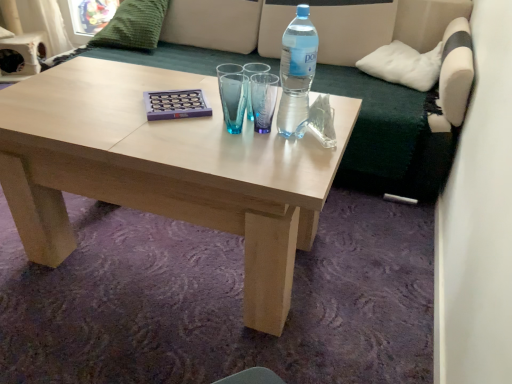
Question: Does green fabric couch at upper center have a lesser width compared to green knitted pillow at upper left, arranged as the first pillow when viewed from the left?

Choices:
 (A) no
 (B) yes

Answer: (A)

Question: From the image's perspective, is green fabric couch at upper center on green knitted pillow at upper left, arranged as the first pillow when viewed from the left?

Choices:
 (A) yes
 (B) no

Answer: (B)

Question: Does green fabric couch at upper center appear on the right side of green knitted pillow at upper left, arranged as the first pillow when viewed from the left?

Choices:
 (A) no
 (B) yes

Answer: (B)

Question: From the image's perspective, is green fabric couch at upper center under green knitted pillow at upper left, the second pillow positioned from the bottom?

Choices:
 (A) yes
 (B) no

Answer: (A)

Question: Is green fabric couch at upper center bigger than green knitted pillow at upper left, which ranks as the first pillow in top-to-bottom order?

Choices:
 (A) no
 (B) yes

Answer: (B)

Question: From the image's perspective, is transparent plastic bottle at upper right above or below natural wood coffee table at center?

Choices:
 (A) above
 (B) below

Answer: (A)

Question: Relative to natural wood coffee table at center, is transparent plastic bottle at upper right in front or behind?

Choices:
 (A) front
 (B) behind

Answer: (B)

Question: Is transparent plastic bottle at upper right inside or outside of natural wood coffee table at center?

Choices:
 (A) outside
 (B) inside

Answer: (A)

Question: From a real-world perspective, is transparent plastic bottle at upper right physically located above or below natural wood coffee table at center?

Choices:
 (A) below
 (B) above

Answer: (B)

Question: Is point (280, 258) closer or farther from the camera than point (283, 34)?

Choices:
 (A) farther
 (B) closer

Answer: (B)

Question: Considering the positions of natural wood coffee table at center and transparent plastic bottle at upper right in the image, is natural wood coffee table at center bigger or smaller than transparent plastic bottle at upper right?

Choices:
 (A) big
 (B) small

Answer: (A)

Question: Would you say natural wood coffee table at center is inside or outside transparent plastic bottle at upper right?

Choices:
 (A) outside
 (B) inside

Answer: (A)

Question: From the image's perspective, is natural wood coffee table at center positioned above or below transparent plastic bottle at upper right?

Choices:
 (A) above
 (B) below

Answer: (B)

Question: Does point (470, 66) appear closer or farther from the camera than point (166, 178)?

Choices:
 (A) farther
 (B) closer

Answer: (A)

Question: From the image's perspective, is green fabric couch at upper center located above or below natural wood coffee table at center?

Choices:
 (A) below
 (B) above

Answer: (B)